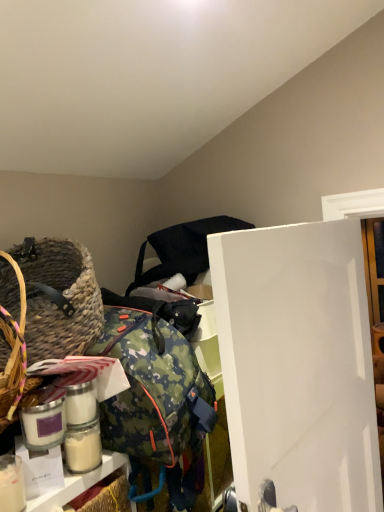
Question: Is black fabric bag at upper center to the left or to the right of white matte glass jar at lower left in the image?

Choices:
 (A) right
 (B) left

Answer: (A)

Question: Looking at the image, does black fabric bag at upper center seem bigger or smaller compared to white matte glass jar at lower left?

Choices:
 (A) big
 (B) small

Answer: (A)

Question: Which object is positioned closest to the white glossy door at center right?

Choices:
 (A) woven straw picnic basket at left
 (B) white matte glass jar at lower left
 (C) black fabric bag at upper center

Answer: (C)

Question: Which object is positioned closest to the woven straw picnic basket at left?

Choices:
 (A) black fabric bag at upper center
 (B) white matte glass jar at lower left
 (C) white glossy door at center right

Answer: (B)